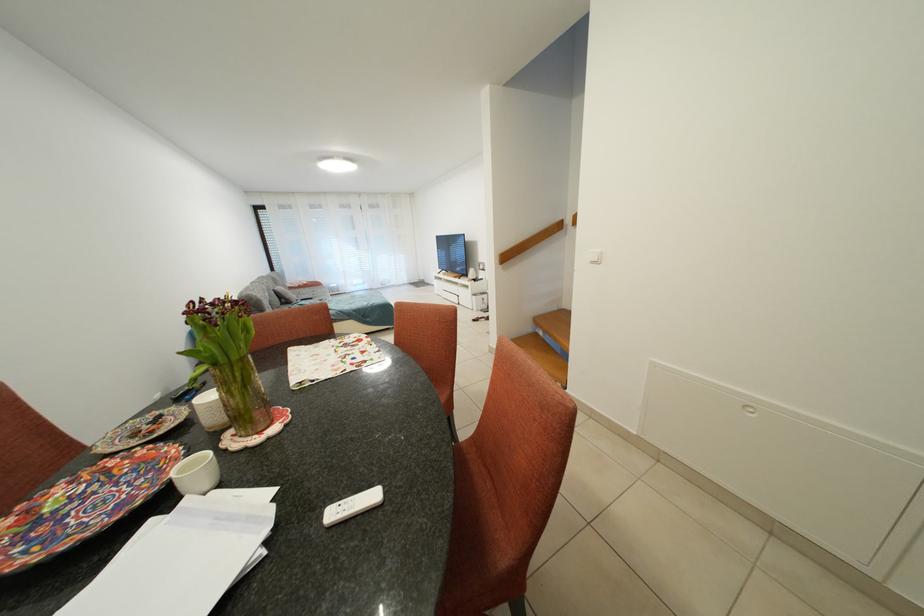
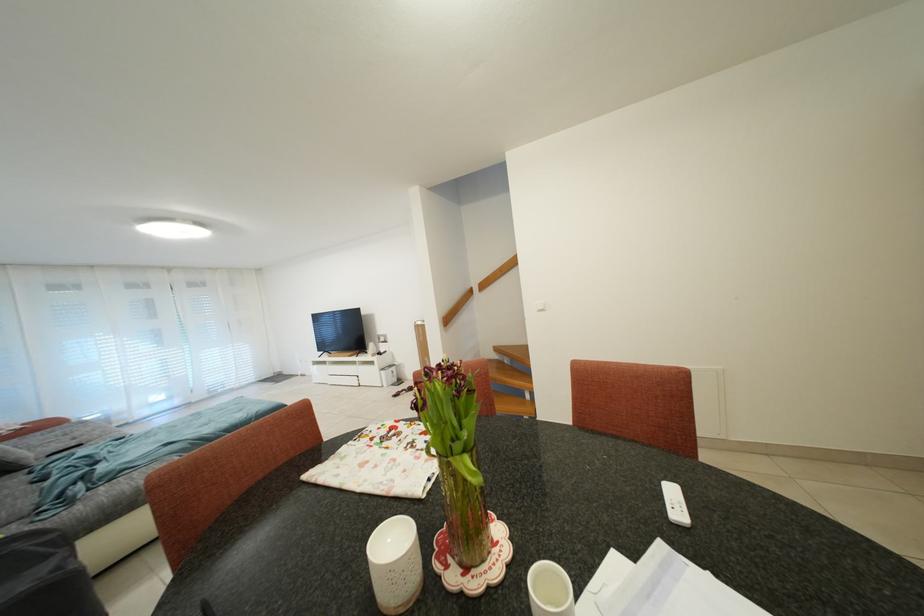
Where in the second image is the point corresponding to (223,369) from the first image?

(472, 455)